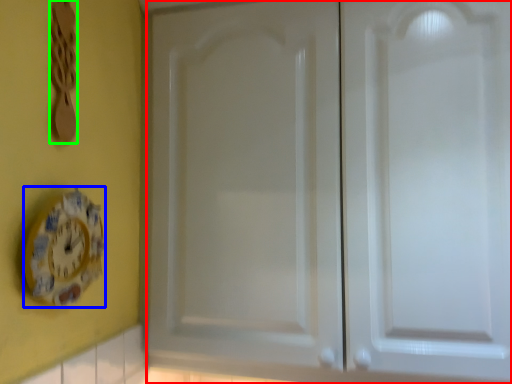
Question: Considering the real-world distances, which object is closest to door (highlighted by a red box)? clock (highlighted by a blue box) or spoon (highlighted by a green box).

Choices:
 (A) clock
 (B) spoon

Answer: (A)